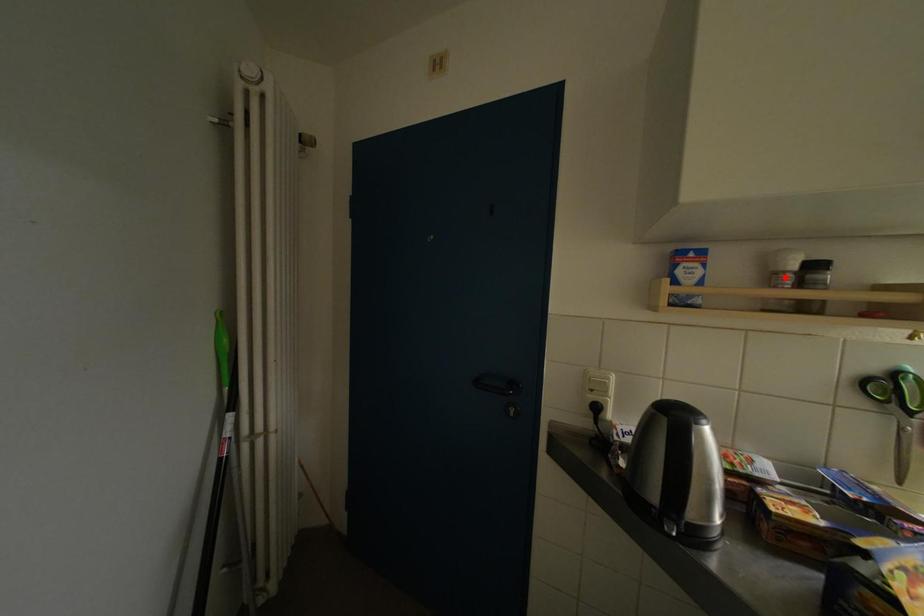
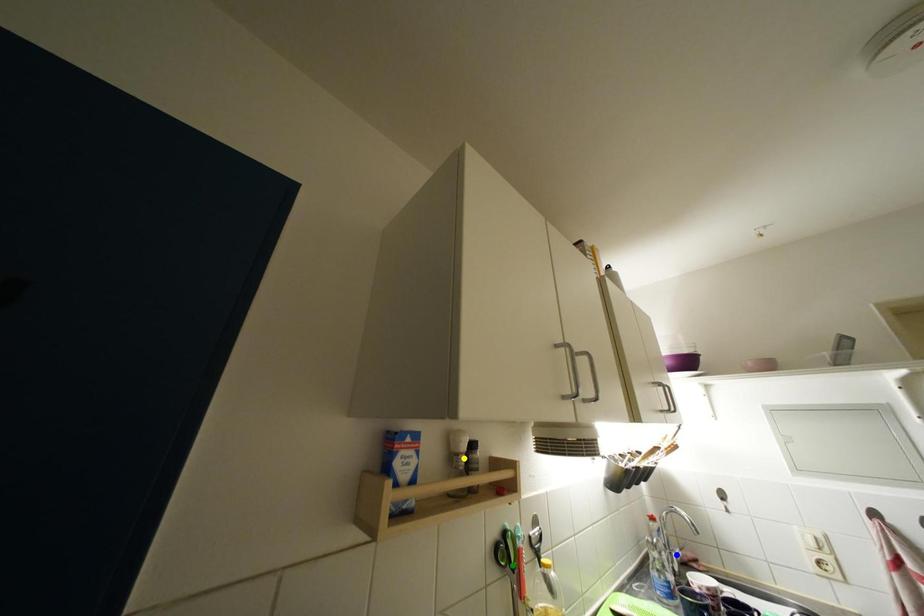
Question: I am providing you with two images of the same scene from different viewpoints. A red point is marked on the first image. You are given multiple points on the second image. Which mark in image 2 goes with the point in image 1?

Choices:
 (A) blue point
 (B) yellow point
 (C) green point

Answer: (B)